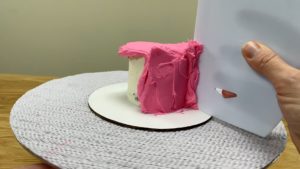
Locate an element on the screen. light grey textured circle surface is located at coordinates (173, 155).